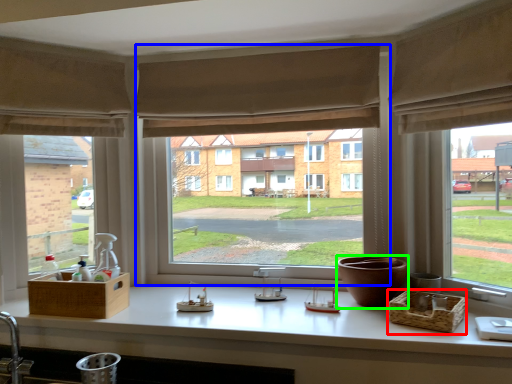
Question: Which object is positioned farthest from basket (highlighted by a red box)? Select from window (highlighted by a blue box) and vase (highlighted by a green box).

Choices:
 (A) window
 (B) vase

Answer: (A)